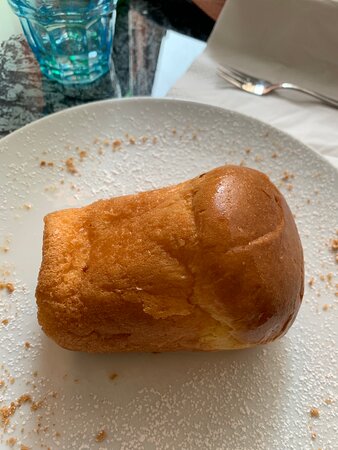
You are a GUI agent. You are given a task and a screenshot of the screen. Output one action in this format:
    pyautogui.click(x=<x>, y=<y>)
    Task: Click on the fork
    
    Given the screenshot: What is the action you would take?
    pyautogui.click(x=254, y=79)